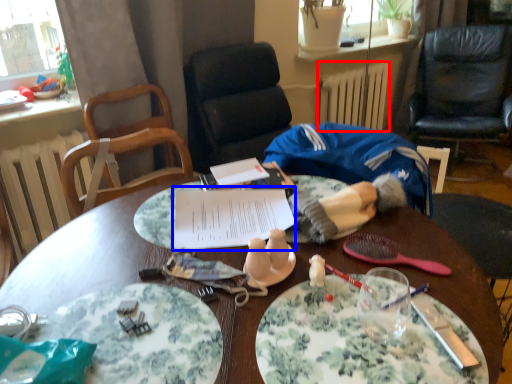
Question: Which point is further to the camera, radiator (highlighted by a red box) or notebook (highlighted by a blue box)?

Choices:
 (A) radiator
 (B) notebook

Answer: (A)